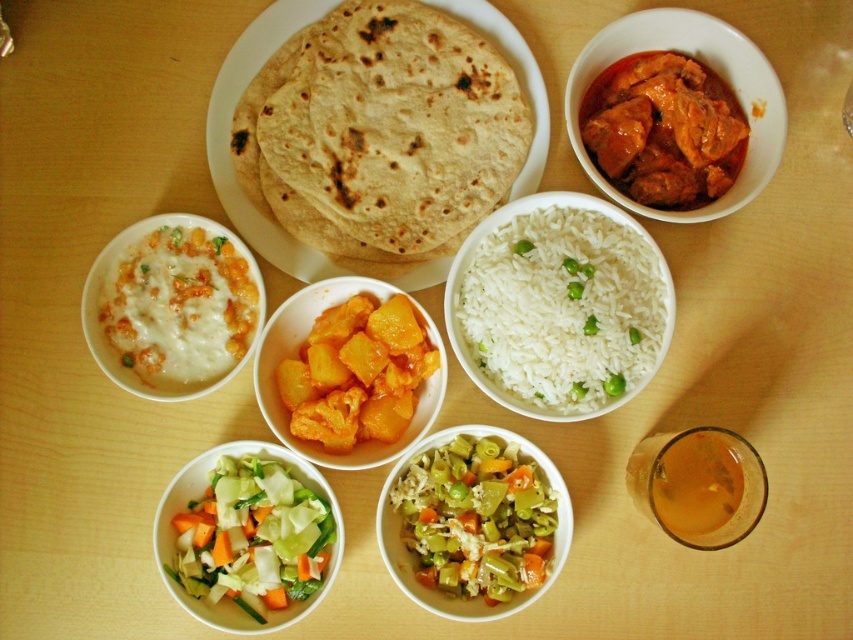
Question: Can you confirm if white polished rice at center is smaller than yellow matte pineapple at center?

Choices:
 (A) no
 (B) yes

Answer: (B)

Question: Can you confirm if fresh green leafy vegetables at lower left is positioned below shiny green vegetables at center?

Choices:
 (A) yes
 (B) no

Answer: (A)

Question: Which point is farther from the camera taking this photo?

Choices:
 (A) (550, 396)
 (B) (283, 540)
 (C) (717, 42)
 (D) (253, 28)

Answer: (D)

Question: Does matte brown curry at upper right appear on the left side of translucent glass cup at lower right?

Choices:
 (A) no
 (B) yes

Answer: (B)

Question: Which of the following is the farthest from the observer?

Choices:
 (A) (105, 349)
 (B) (462, 429)

Answer: (A)

Question: Which point is farther to the camera?

Choices:
 (A) (726, 536)
 (B) (247, 77)

Answer: (B)